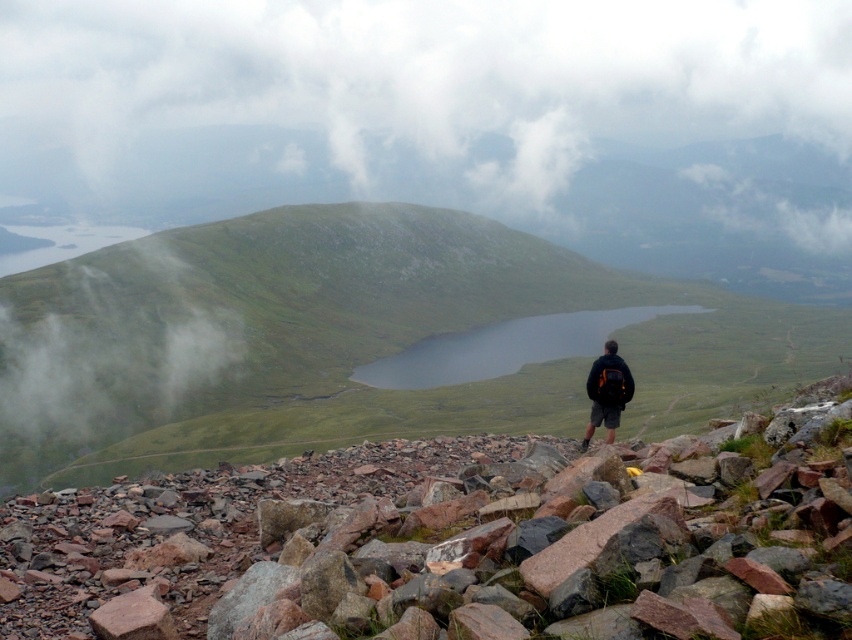
You are standing at the vantage point and want to identify the object located at the coordinates point (394, 97). What is it?

The object at point (394, 97) is a white fluffy cloud at upper center.

You are a hiker planning to take a photo of the white fluffy cloud at upper center and the rusty rock pile at center from your current position. Can you fit both objects in the frame of your camera, which has a maximum field of view of 450 meters?

The distance between the white fluffy cloud at upper center and the rusty rock pile at center is 447.70 meters, which is within the camera field of view of 450 meters. Therefore, both objects can be captured in a single frame.

You are standing at the top of the mountain looking at the white fluffy cloud at upper center and the dark blue jacket at center. If you want to throw a stone to hit both objects, which one should you aim for first and why?

You should aim for the dark blue jacket at center first because it is closer to you than the white fluffy cloud at upper center. The distance between them is 565.35 meters, so the jacket is much nearer.